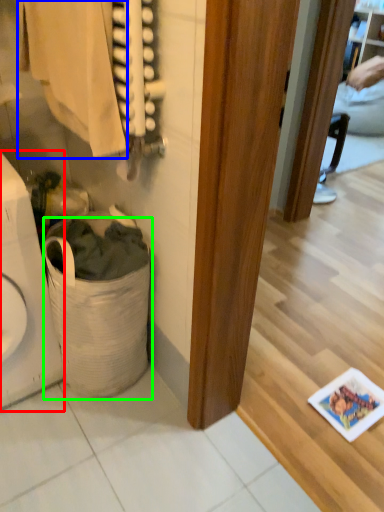
Question: Based on their relative distances, which object is farther from appliance (highlighted by a red box)? Choose from clothing (highlighted by a blue box) and laundry basket (highlighted by a green box).

Choices:
 (A) clothing
 (B) laundry basket

Answer: (A)